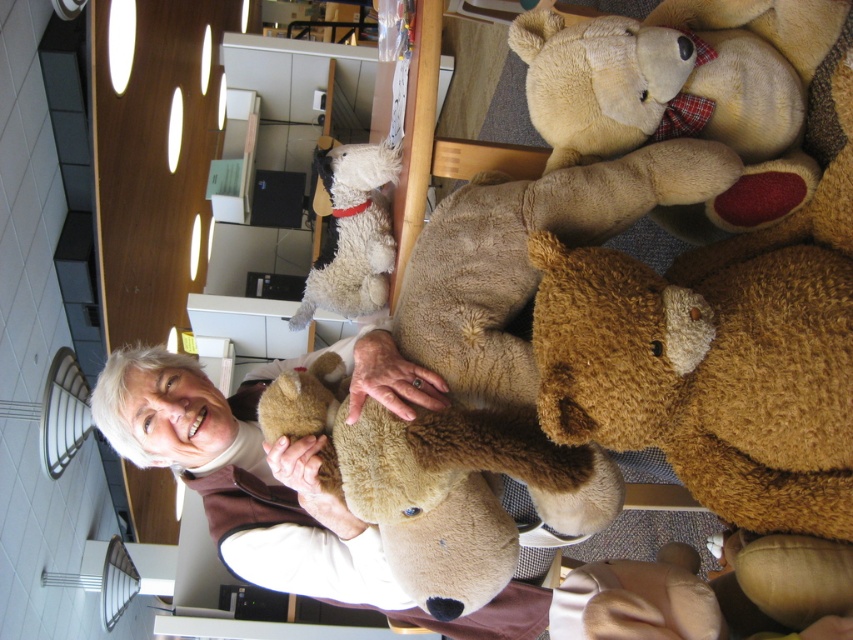
Who is positioned more to the right, brown plush teddy bear at center or soft beige teddy bear at upper right?

Positioned to the right is soft beige teddy bear at upper right.

Can you confirm if brown plush teddy bear at center is smaller than soft beige teddy bear at upper right?

Yes, brown plush teddy bear at center is smaller than soft beige teddy bear at upper right.

Measure the distance between brown plush teddy bear at center and camera.

A distance of 3.73 feet exists between brown plush teddy bear at center and camera.

Locate an element on the screen. Image resolution: width=853 pixels, height=640 pixels. brown plush teddy bear at center is located at coordinates (708, 376).

Based on the photo, can you confirm if soft beige teddy bear at upper right is positioned to the right of fuzzy beige dog at upper center?

Correct, you'll find soft beige teddy bear at upper right to the right of fuzzy beige dog at upper center.

Is soft beige teddy bear at upper right further to the viewer compared to fuzzy beige dog at upper center?

No, it is in front of fuzzy beige dog at upper center.

The height and width of the screenshot is (640, 853). I want to click on soft beige teddy bear at upper right, so click(677, 97).

Is brown plush teddy bear at center above fuzzy beige dog at upper center?

Incorrect, brown plush teddy bear at center is not positioned above fuzzy beige dog at upper center.

Consider the image. Can you confirm if brown plush teddy bear at center is shorter than fuzzy beige dog at upper center?

No.

This screenshot has height=640, width=853. What are the coordinates of `brown plush teddy bear at center` in the screenshot? It's located at (708, 376).